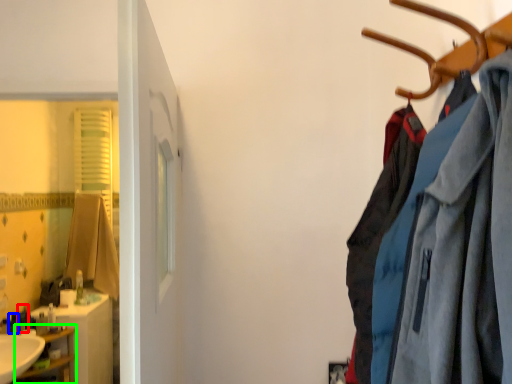
Question: Which is farther away from toiletry (highlighted by a red box)? toiletry (highlighted by a blue box) or shelf (highlighted by a green box)?

Choices:
 (A) toiletry
 (B) shelf

Answer: (B)